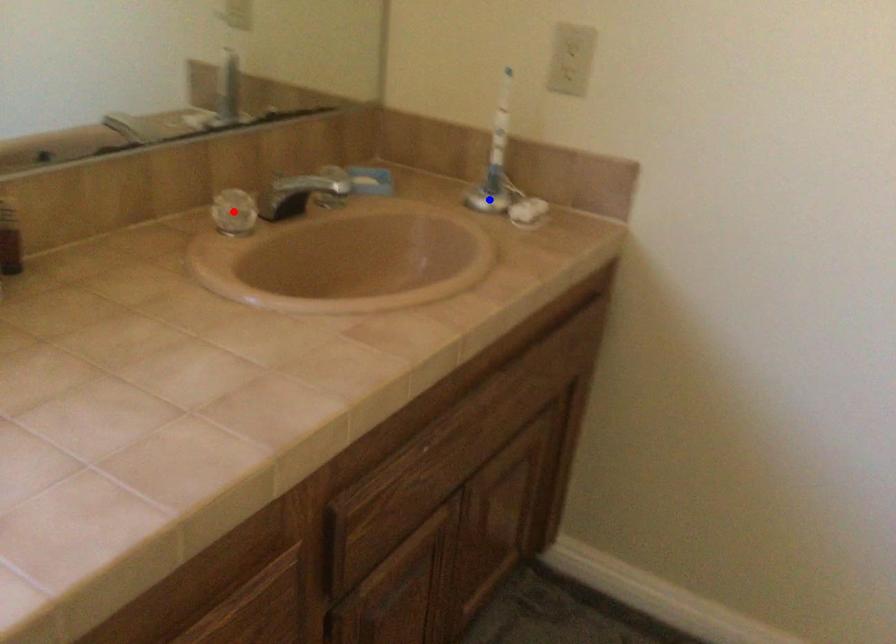
Question: Two points are marked on the image. Which point is closer to the camera?

Choices:
 (A) Blue point is closer.
 (B) Red point is closer.

Answer: (B)